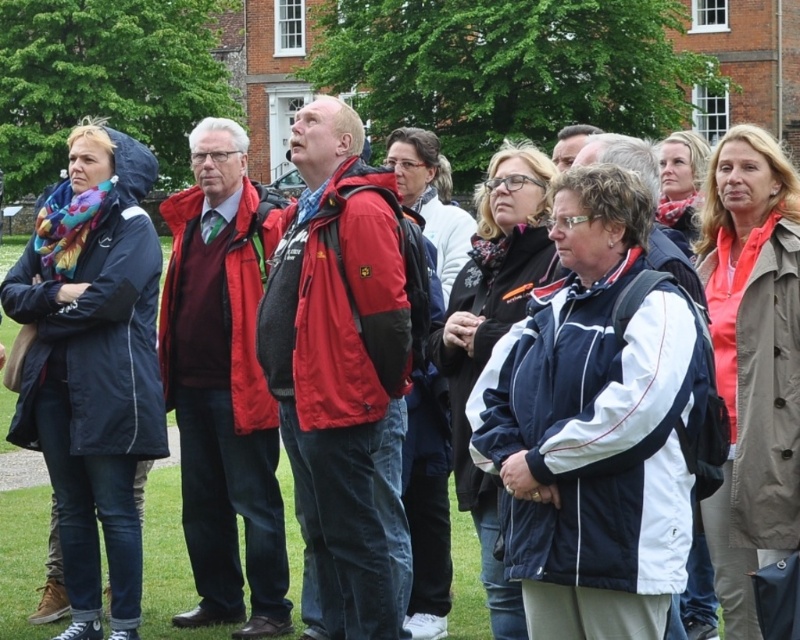
Between navy blue/white jacket at center and matte red jacket at center, which one has more height?

matte red jacket at center is taller.

Who is more forward, (586, 256) or (360, 561)?

Point (586, 256) is in front.

This screenshot has height=640, width=800. Identify the location of navy blue/white jacket at center. tap(594, 424).

Which is below, matte red jacket at center or matte red sweater at center?

matte red sweater at center is below.

This screenshot has width=800, height=640. In order to click on matte red jacket at center in this screenshot , I will do `click(341, 372)`.

Which is more to the left, navy blue/white jacket at center or matte blue jacket at left?

matte blue jacket at left

Where is `navy blue/white jacket at center`? navy blue/white jacket at center is located at coordinates (594, 424).

Which is behind, point (552, 390) or point (58, 230)?

Positioned behind is point (58, 230).

This screenshot has height=640, width=800. In order to click on navy blue/white jacket at center in this screenshot , I will do `click(594, 424)`.